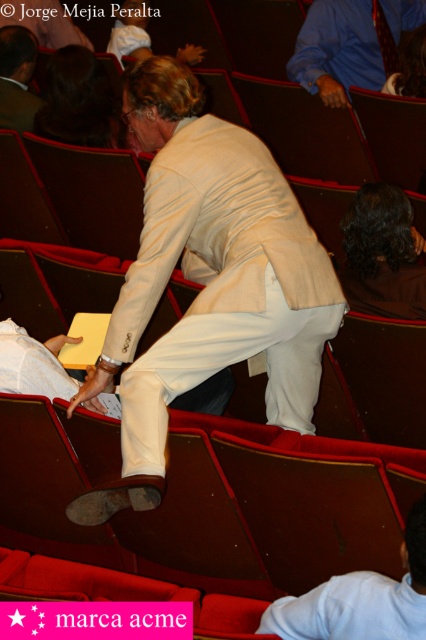
Is brown fabric hair at center wider than matte black jacket at upper left?

Correct, the width of brown fabric hair at center exceeds that of matte black jacket at upper left.

The image size is (426, 640). What do you see at coordinates (382, 253) in the screenshot?
I see `brown fabric hair at center` at bounding box center [382, 253].

Image resolution: width=426 pixels, height=640 pixels. Find the location of `brown fabric hair at center`. brown fabric hair at center is located at coordinates (382, 253).

Between dark brown hair at upper left and matte black jacket at upper left, which one is positioned higher?

matte black jacket at upper left is above.

Does dark brown hair at upper left have a smaller size compared to matte black jacket at upper left?

Actually, dark brown hair at upper left might be larger than matte black jacket at upper left.

Who is more distant from viewer, [108,136] or [32,52]?

Point [32,52]

Where is `dark brown hair at upper left`? This screenshot has width=426, height=640. dark brown hair at upper left is located at coordinates (80, 100).

Is matte white suit at center further to the viewer compared to dark brown hair at upper left?

No.

Between point (161, 435) and point (74, 49), which one is positioned in front?

Point (161, 435) is in front.

Which is behind, point (285, 403) or point (108, 109)?

Positioned behind is point (108, 109).

The width and height of the screenshot is (426, 640). I want to click on matte white suit at center, so click(207, 280).